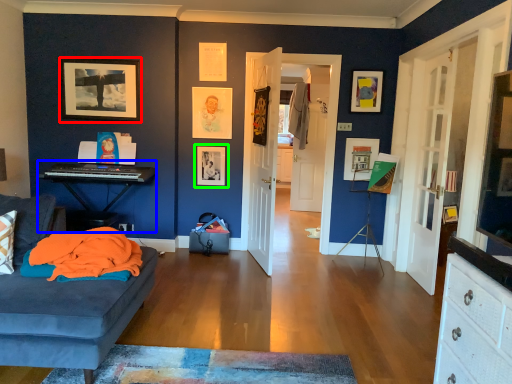
Question: Based on their relative distances, which object is farther from picture frame (highlighted by a red box)? Choose from computer desk (highlighted by a blue box) and picture frame (highlighted by a green box).

Choices:
 (A) computer desk
 (B) picture frame

Answer: (B)